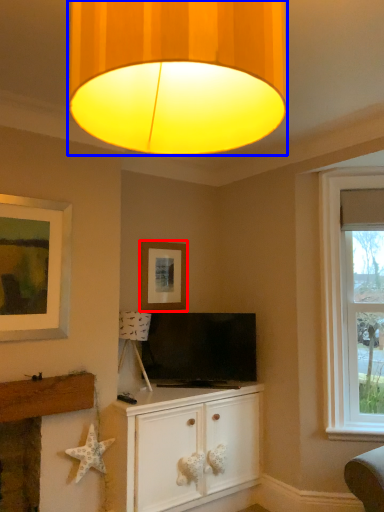
Question: Which object is further to the camera taking this photo, picture frame (highlighted by a red box) or lamp (highlighted by a blue box)?

Choices:
 (A) picture frame
 (B) lamp

Answer: (A)